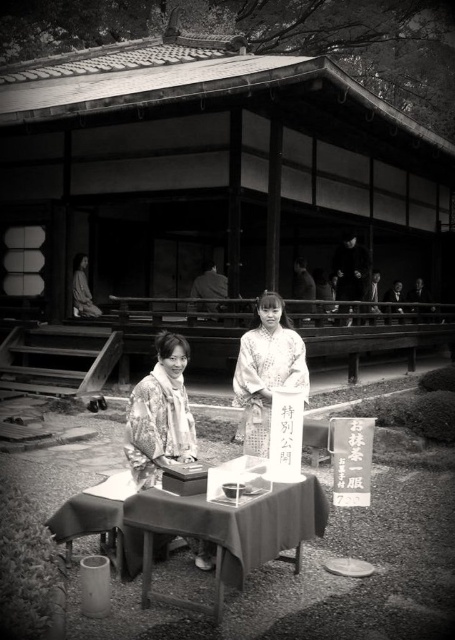
Question: Is smooth wooden table at center thinner than silky white kimono at center?

Choices:
 (A) yes
 (B) no

Answer: (B)

Question: Is smooth wooden table at center to the right of silky white kimono at center from the viewer's perspective?

Choices:
 (A) no
 (B) yes

Answer: (A)

Question: Which object is positioned farthest from the smooth wooden table at center?

Choices:
 (A) silky white kimono at center
 (B) floral kimono at center

Answer: (A)

Question: Which point is farther from the camera taking this photo?

Choices:
 (A) (308, 483)
 (B) (264, 362)
 (C) (147, 424)

Answer: (B)

Question: Which point is farther to the camera?

Choices:
 (A) (284, 525)
 (B) (177, 403)

Answer: (B)

Question: Is smooth wooden table at center thinner than floral kimono at center?

Choices:
 (A) yes
 (B) no

Answer: (B)